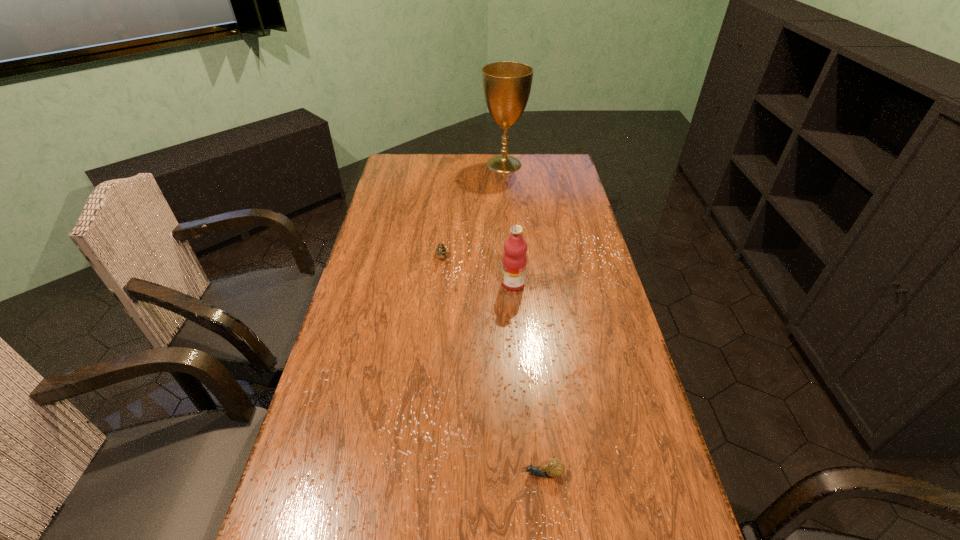
In order to click on vacant region located on the label of the fruit juice in this screenshot , I will do `click(432, 284)`.

Identify the location of vacant space situated on the label of the fruit juice. (395, 284).

The image size is (960, 540). In order to click on vacant space located on the face of the leftmost object in this screenshot , I will do `click(438, 296)`.

Identify the location of vacant space situated on the front-facing side of the shortest object. The image size is (960, 540). (485, 474).

Identify the location of vacant space situated 0.080m on the front-facing side of the shortest object. The height and width of the screenshot is (540, 960). (485, 474).

Find the location of a particular element. vacant space situated 0.320m on the front-facing side of the shortest object is located at coordinates (374, 474).

Locate an element on the screen. The image size is (960, 540). object that is at the far edge is located at coordinates (507, 85).

You are a GUI agent. You are given a task and a screenshot of the screen. Output one action in this format:
    pyautogui.click(x=<x>, y=<y>)
    Task: Click on the free space at the far edge
    
    Given the screenshot: What is the action you would take?
    pyautogui.click(x=459, y=179)

At what (x,y) coordinates should I click in order to perform the action: click on vacant space at the left edge. Please return your answer as a coordinate pair (x, y). The height and width of the screenshot is (540, 960). Looking at the image, I should click on (389, 245).

The image size is (960, 540). In the image, there is a desktop. What are the coordinates of `vacant space at the right edge` in the screenshot? It's located at (653, 448).